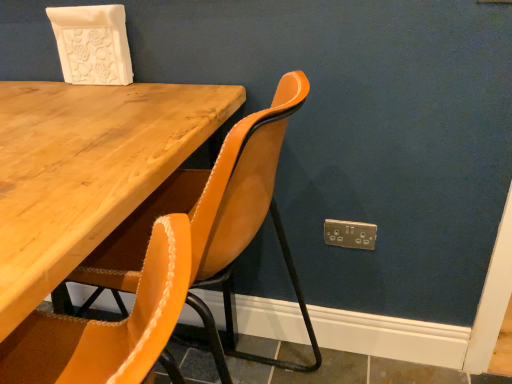
Question: In terms of height, does suede-like mustard chair at center look taller or shorter compared to gold metallic electric outlet at lower right?

Choices:
 (A) tall
 (B) short

Answer: (A)

Question: Would you say suede-like mustard chair at center is to the left or to the right of gold metallic electric outlet at lower right in the picture?

Choices:
 (A) left
 (B) right

Answer: (A)

Question: From a real-world perspective, is suede-like mustard chair at center physically located above or below gold metallic electric outlet at lower right?

Choices:
 (A) above
 (B) below

Answer: (A)

Question: Considering the relative positions of gold metallic electric outlet at lower right and suede-like mustard chair at center in the image provided, is gold metallic electric outlet at lower right to the left or to the right of suede-like mustard chair at center?

Choices:
 (A) right
 (B) left

Answer: (A)

Question: Does point (361, 241) appear closer or farther from the camera than point (261, 110)?

Choices:
 (A) closer
 (B) farther

Answer: (B)

Question: From the image's perspective, is gold metallic electric outlet at lower right above or below suede-like mustard chair at center?

Choices:
 (A) above
 (B) below

Answer: (A)

Question: Which is correct: gold metallic electric outlet at lower right is inside suede-like mustard chair at center, or outside of it?

Choices:
 (A) inside
 (B) outside

Answer: (B)